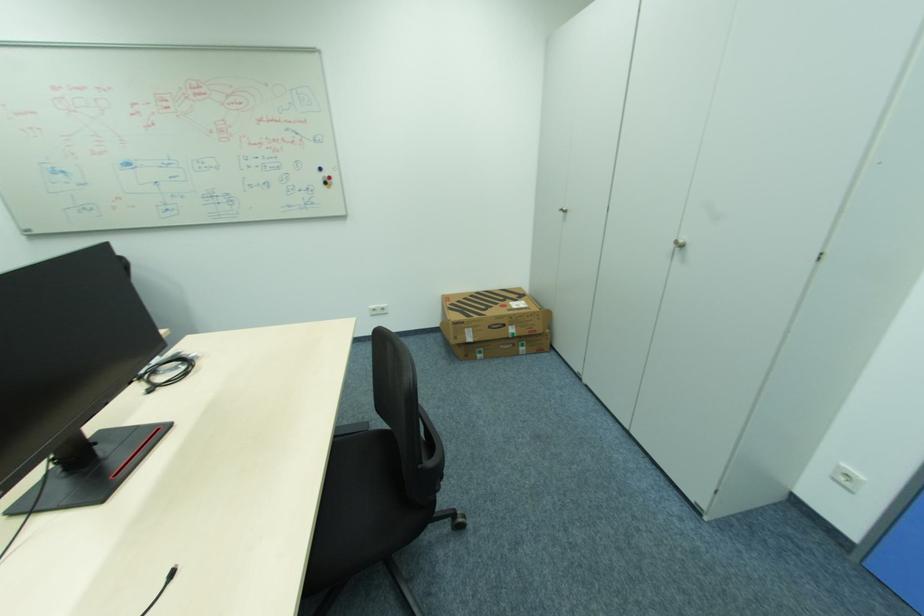
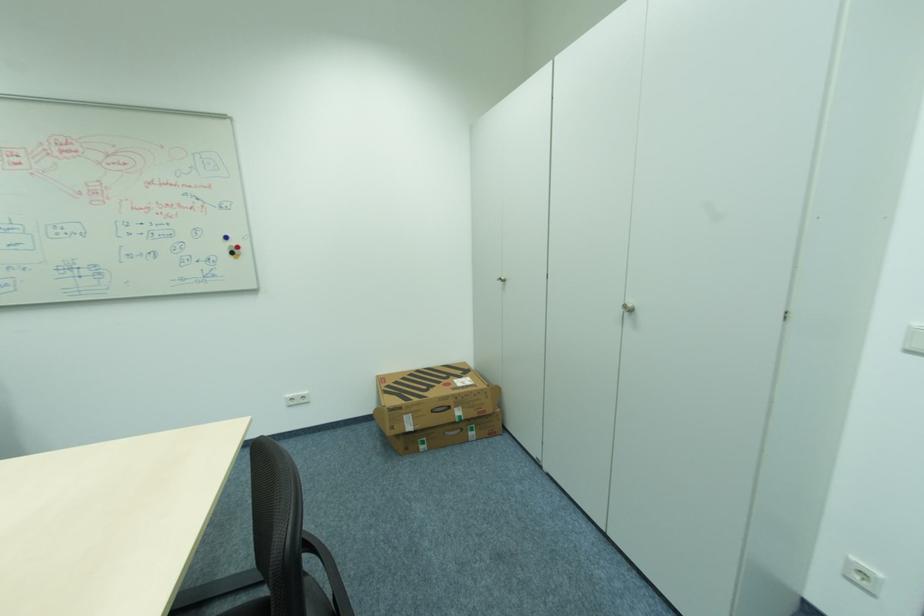
Question: In a continuous first-person perspective shot, in which direction is the camera moving?

Choices:
 (A) Left
 (B) Right
 (C) Forward
 (D) Backward

Answer: (C)